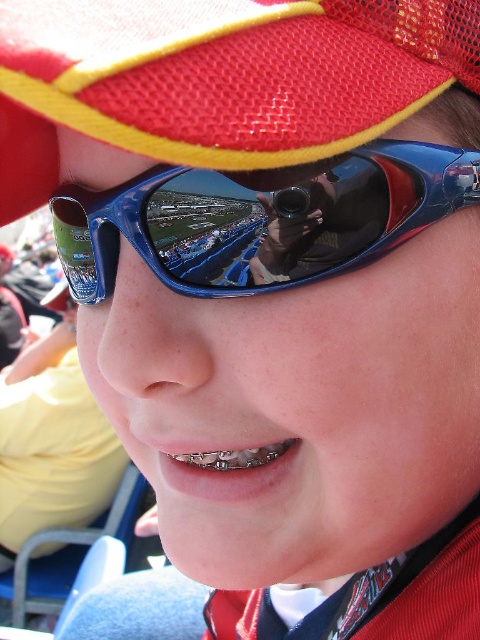
You are a photographer trying to capture both the red mesh baseball cap at upper center and the black satin tie at lower right in the same frame. Which object should you adjust your camera to focus on first to ensure both are in the frame?

You should focus on the red mesh baseball cap at upper center first because it is positioned to the left of the black satin tie at lower right, so adjusting the frame to include the leftmost object ensures the rightward object is also captured.

You are a photographer standing 12 inches away from a subject. You want to take a closeup portrait of their face. The blue shiny sunglasses at center is in the way. Can you move closer to take the photo without moving the subject?

The blue shiny sunglasses at center is 11.93 inches away from viewer, which is less than 12 inches. To take the photo without moving the subject, you would need to move closer than 11.93 inches, but since you are already at 12 inches, you cannot move closer. Therefore, you cannot take the photo without moving the subject.